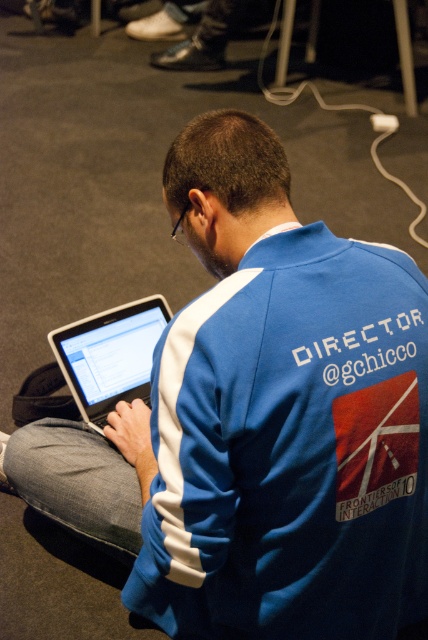
Between point (279, 413) and point (73, 339), which one is positioned behind?

The point (73, 339) is more distant.

Based on the photo, is blue fabric sweatshirt at center in front of satin silver laptop at center?

Yes, blue fabric sweatshirt at center is closer to the viewer.

In order to click on blue fabric sweatshirt at center in this screenshot , I will do `click(291, 449)`.

Does point (181, 509) come farther from viewer compared to point (110, 484)?

No, (181, 509) is in front of (110, 484).

Which is behind, point (243, 314) or point (98, 481)?

The point (98, 481) is behind.

Describe the element at coordinates (291, 449) in the screenshot. I see `blue fabric sweatshirt at center` at that location.

Where is `blue fabric sweatshirt at center`? The height and width of the screenshot is (640, 428). blue fabric sweatshirt at center is located at coordinates (291, 449).

Who is taller, gray fabric lap at lower left or satin silver laptop at center?

satin silver laptop at center

Between gray fabric lap at lower left and satin silver laptop at center, which one is positioned higher?

satin silver laptop at center is higher up.

Between point (136, 512) and point (112, 372), which one is positioned in front?

Positioned in front is point (136, 512).

The height and width of the screenshot is (640, 428). Find the location of `gray fabric lap at lower left`. gray fabric lap at lower left is located at coordinates (77, 483).